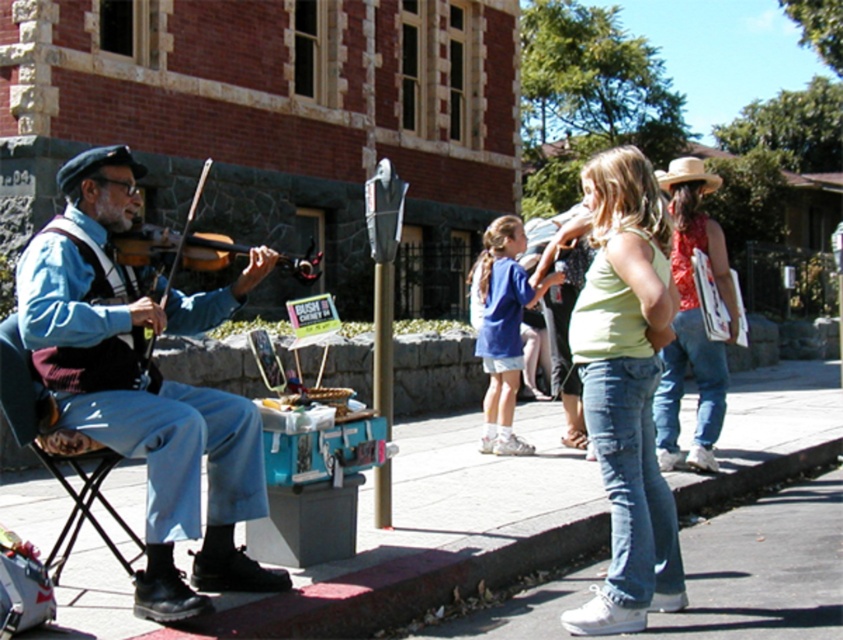
You are a photographer trying to capture a clear photo of the light green tank top at center and the dark blue fabric folding chair at left. Since you want both objects to be in focus, you need to know which one is taller. Can you tell me which object is taller?

The light green tank top at center is taller than the dark blue fabric folding chair at left.